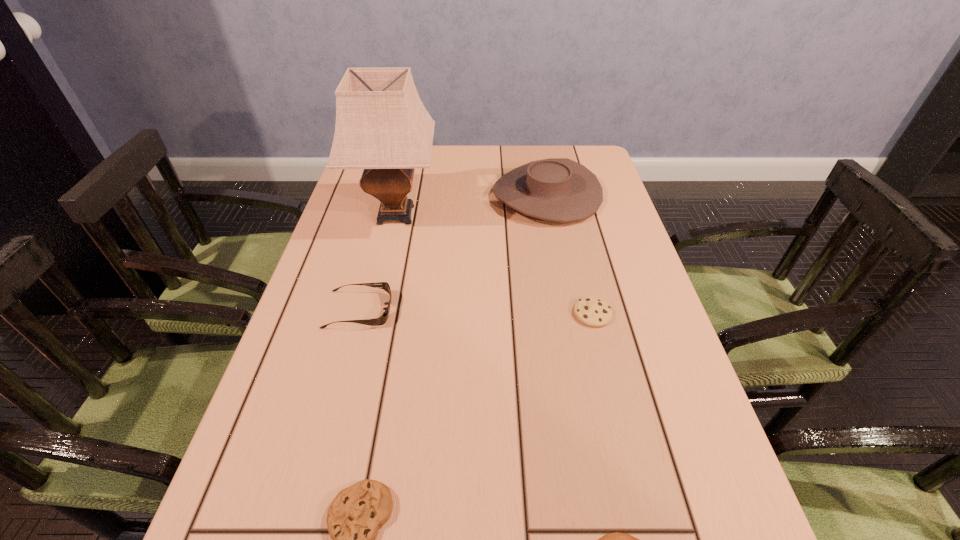
The height and width of the screenshot is (540, 960). Identify the location of vacant region between the lampshade and the second tallest object. (471, 205).

This screenshot has height=540, width=960. What are the coordinates of `vacant space that is in between the third tallest object and the cowboy hat` in the screenshot? It's located at (453, 252).

Find the location of `vacant area that lies between the lampshade and the fourth shortest object`. vacant area that lies between the lampshade and the fourth shortest object is located at coordinates (377, 262).

Identify which object is the fourth nearest to the farthest cookie. Please provide its 2D coordinates. Your answer should be formatted as a tuple, i.e. [(x, y)], where the tuple contains the x and y coordinates of a point satisfying the conditions above.

[(382, 319)]

Find the location of `object that ranks as the fifth closest to the fourth shortest object`. object that ranks as the fifth closest to the fourth shortest object is located at coordinates (616, 539).

Find the location of a particular element. Image resolution: width=960 pixels, height=540 pixels. cookie that is the closest one to the second tallest object is located at coordinates (595, 312).

The image size is (960, 540). Find the location of `the closest cookie to the leftmost cookie`. the closest cookie to the leftmost cookie is located at coordinates (616, 539).

Locate an element on the screen. free point that satisfies the following two spatial constraints: 1. on the front side of the tallest object; 2. on the right side of the farthest cookie is located at coordinates (372, 314).